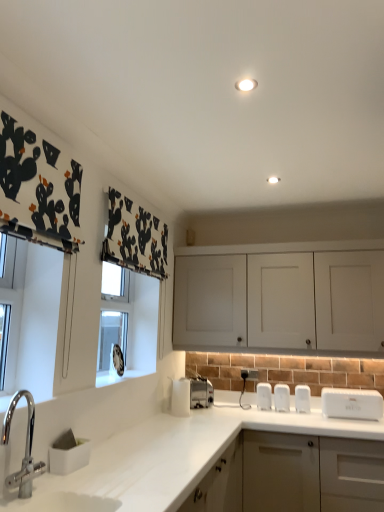
What do you see at coordinates (264, 396) in the screenshot? The image size is (384, 512). I see `white plastic salt and pepper shakers at center, which is the second appliance from left to right` at bounding box center [264, 396].

How much space does white matte cabinet at upper center, which ranks as the 1th cabinetry in top-to-bottom order, occupy horizontally?

The width of white matte cabinet at upper center, which ranks as the 1th cabinetry in top-to-bottom order, is 16.98 inches.

Looking at this image, what is the approximate width of brushed metal faucet at lower left?

The width of brushed metal faucet at lower left is 4.35 inches.

Where is `white plastic salt and pepper shakers at center, which is the second appliance from left to right`? white plastic salt and pepper shakers at center, which is the second appliance from left to right is located at coordinates (264, 396).

Does point (253, 374) appear closer or farther from the camera than point (261, 406)?

Point (253, 374) is positioned farther from the camera compared to point (261, 406).

From the image's perspective, which is below, white plastic electric outlet at lower center or white plastic salt and pepper shakers at center, which is the second appliance from left to right?

white plastic salt and pepper shakers at center, which is the second appliance from left to right, appears lower in the image.

Does white plastic electric outlet at lower center have a smaller size compared to white plastic salt and pepper shakers at center, placed as the 2th appliance when sorted from right to left?

Correct, white plastic electric outlet at lower center occupies less space than white plastic salt and pepper shakers at center, placed as the 2th appliance when sorted from right to left.

Is white plastic electric outlet at lower center directly adjacent to white plastic salt and pepper shakers at center, placed as the 2th appliance when sorted from right to left?

white plastic electric outlet at lower center and white plastic salt and pepper shakers at center, placed as the 2th appliance when sorted from right to left, are clearly separated.

Which of these two, white matte countertop at lower left or satin silver toaster at lower center, arranged as the 3th appliance when viewed from the right, is bigger?

white matte countertop at lower left.

Is white matte countertop at lower left taller than satin silver toaster at lower center, placed as the first appliance when sorted from left to right?

Yes, white matte countertop at lower left is taller than satin silver toaster at lower center, placed as the first appliance when sorted from left to right.

Consider the image. From a real-world perspective, does white matte countertop at lower left sit lower than satin silver toaster at lower center, arranged as the 3th appliance when viewed from the right?

Yes, from a real-world perspective, white matte countertop at lower left is under satin silver toaster at lower center, arranged as the 3th appliance when viewed from the right.

From the picture: Can you confirm if brushed metal faucet at lower left is positioned to the right of satin silver toaster at lower center, placed as the first appliance when sorted from left to right?

In fact, brushed metal faucet at lower left is to the left of satin silver toaster at lower center, placed as the first appliance when sorted from left to right.

Which object is thinner, brushed metal faucet at lower left or satin silver toaster at lower center, arranged as the 3th appliance when viewed from the right?

With smaller width is brushed metal faucet at lower left.

Locate an element on the screen. Image resolution: width=384 pixels, height=512 pixels. tap below the satin silver toaster at lower center, arranged as the 3th appliance when viewed from the right (from a real-world perspective) is located at coordinates (25, 448).

Based on the photo, considering the relative sizes of brushed metal faucet at lower left and satin silver toaster at lower center, arranged as the 3th appliance when viewed from the right, in the image provided, is brushed metal faucet at lower left bigger than satin silver toaster at lower center, arranged as the 3th appliance when viewed from the right,?

Actually, brushed metal faucet at lower left might be smaller than satin silver toaster at lower center, arranged as the 3th appliance when viewed from the right.

Between satin silver toaster at lower center, arranged as the 3th appliance when viewed from the right, and brushed metal faucet at lower left, which one appears on the left side from the viewer's perspective?

From the viewer's perspective, brushed metal faucet at lower left appears more on the left side.

Which appliance is the 2nd one when counting from the back of the brushed metal faucet at lower left? Please provide its 2D coordinates.

[(191, 395)]

Is satin silver toaster at lower center, placed as the first appliance when sorted from left to right, far away from brushed metal faucet at lower left?

Answer: satin silver toaster at lower center, placed as the first appliance when sorted from left to right, is far away from brushed metal faucet at lower left.

Which object is closer to the camera taking this photo, satin silver toaster at lower center, placed as the first appliance when sorted from left to right, or brushed metal faucet at lower left?

brushed metal faucet at lower left is more forward.

Considering the positions of objects satin silver toaster at lower center, placed as the first appliance when sorted from left to right, and white matte countertop at lower left in the image provided, who is more to the left, satin silver toaster at lower center, placed as the first appliance when sorted from left to right, or white matte countertop at lower left?

Positioned to the left is white matte countertop at lower left.

Looking at this image, is satin silver toaster at lower center, arranged as the 3th appliance when viewed from the right, thinner than white matte countertop at lower left?

Yes.

Considering the relative sizes of satin silver toaster at lower center, arranged as the 3th appliance when viewed from the right, and white matte countertop at lower left in the image provided, is satin silver toaster at lower center, arranged as the 3th appliance when viewed from the right, taller than white matte countertop at lower left?

No, satin silver toaster at lower center, arranged as the 3th appliance when viewed from the right, is not taller than white matte countertop at lower left.

Is satin silver toaster at lower center, placed as the first appliance when sorted from left to right, inside or outside of white matte countertop at lower left?

satin silver toaster at lower center, placed as the first appliance when sorted from left to right, lies outside white matte countertop at lower left.

Can you tell me how much white matte countertop at lower left and white plastic toaster at right, which is counted as the first appliance, starting from the right, differ in facing direction?

The angle between the facing direction of white matte countertop at lower left and the facing direction of white plastic toaster at right, which is counted as the first appliance, starting from the right, is 89.4 degrees.

Is white matte countertop at lower left inside or outside of white plastic toaster at right, which is the 3th appliance from left to right?

white matte countertop at lower left exists outside the volume of white plastic toaster at right, which is the 3th appliance from left to right.

Does white matte countertop at lower left appear on the left side of white plastic toaster at right, which is counted as the first appliance, starting from the right?

Yes, white matte countertop at lower left is to the left of white plastic toaster at right, which is counted as the first appliance, starting from the right.

Is white matte countertop at lower left positioned far away from white plastic toaster at right, which is counted as the first appliance, starting from the right?

No, white matte countertop at lower left is not far from white plastic toaster at right, which is counted as the first appliance, starting from the right.

Is white plastic toaster at right, which is counted as the first appliance, starting from the right, shorter than white plastic electric outlet at lower center?

Incorrect, the height of white plastic toaster at right, which is counted as the first appliance, starting from the right, does not fall short of that of white plastic electric outlet at lower center.

Does white plastic toaster at right, which is the 3th appliance from left to right, have a greater width compared to white plastic electric outlet at lower center?

Yes, white plastic toaster at right, which is the 3th appliance from left to right, is wider than white plastic electric outlet at lower center.

From the image's perspective, between white plastic toaster at right, which is counted as the first appliance, starting from the right, and white plastic electric outlet at lower center, which one is located above?

white plastic electric outlet at lower center appears higher in the image.

Which object is positioned more to the right, white plastic toaster at right, which is the 3th appliance from left to right, or white plastic electric outlet at lower center?

Positioned to the right is white plastic toaster at right, which is the 3th appliance from left to right.

From the white plastic electric outlet at lower center, count 1st appliances forward and point to it. Please provide its 2D coordinates.

[(264, 396)]

In the image, there is a satin silver toaster at lower center, placed as the first appliance when sorted from left to right. Where is `countertop below it (from a real-world perspective)`? countertop below it (from a real-world perspective) is located at coordinates click(171, 455).

Considering their positions, is matte white cabinet at lower right, placed as the first cabinetry when sorted from bottom to top, positioned closer to white plastic salt and pepper shakers at center, placed as the 2th appliance when sorted from right to left, than white plastic electric outlet at lower center?

white plastic electric outlet at lower center lies closer to white plastic salt and pepper shakers at center, placed as the 2th appliance when sorted from right to left, than the other object.

Which object lies further to the anchor point white plastic electric outlet at lower center, white matte cabinet at upper center, the 2th cabinetry from the bottom, or white plastic salt and pepper shakers at center, placed as the 2th appliance when sorted from right to left?

white matte cabinet at upper center, the 2th cabinetry from the bottom.

Considering their positions, is matte white cabinet at lower right, placed as the first cabinetry when sorted from bottom to top, positioned closer to white matte cabinet at upper center, which ranks as the 1th cabinetry in top-to-bottom order, than white matte countertop at lower left?

white matte countertop at lower left is positioned closer to the anchor white matte cabinet at upper center, which ranks as the 1th cabinetry in top-to-bottom order.

Estimate the real-world distances between objects in this image. Which object is closer to white plastic salt and pepper shakers at center, placed as the 2th appliance when sorted from right to left, matte white cabinet at lower right, placed as the first cabinetry when sorted from bottom to top, or white plastic toaster at right, which is counted as the first appliance, starting from the right?

Based on the image, white plastic toaster at right, which is counted as the first appliance, starting from the right, appears to be nearer to white plastic salt and pepper shakers at center, placed as the 2th appliance when sorted from right to left.

Based on the photo, considering their positions, is white plastic electric outlet at lower center positioned closer to white matte countertop at lower left than matte white cabinet at lower right, arranged as the 2th cabinetry when viewed from the top?

matte white cabinet at lower right, arranged as the 2th cabinetry when viewed from the top, is closer to white matte countertop at lower left.

From the image, which object appears to be farther from white plastic toaster at right, which is the 3th appliance from left to right, brushed metal faucet at lower left or white plastic electric outlet at lower center?

brushed metal faucet at lower left lies further to white plastic toaster at right, which is the 3th appliance from left to right, than the other object.

From the image, which object appears to be farther from white matte countertop at lower left, white plastic salt and pepper shakers at center, placed as the 2th appliance when sorted from right to left, or white plastic electric outlet at lower center?

white plastic electric outlet at lower center.

Considering their positions, is white matte cabinet at upper center, the 2th cabinetry from the bottom, positioned further to matte white cabinet at lower right, arranged as the 2th cabinetry when viewed from the top, than white matte countertop at lower left?

Based on the image, white matte cabinet at upper center, the 2th cabinetry from the bottom, appears to be further to matte white cabinet at lower right, arranged as the 2th cabinetry when viewed from the top.

Where is `cabinetry between white matte countertop at lower left and white matte cabinet at upper center, the 2th cabinetry from the bottom, in the front-back direction`? cabinetry between white matte countertop at lower left and white matte cabinet at upper center, the 2th cabinetry from the bottom, in the front-back direction is located at coordinates (292, 475).

Locate an element on the screen. This screenshot has width=384, height=512. countertop situated between brushed metal faucet at lower left and matte white cabinet at lower right, placed as the first cabinetry when sorted from bottom to top, from left to right is located at coordinates (171, 455).

This screenshot has width=384, height=512. In order to click on appliance located between white matte countertop at lower left and satin silver toaster at lower center, placed as the first appliance when sorted from left to right, in the depth direction in this screenshot , I will do click(352, 403).

The image size is (384, 512). Find the location of `cabinetry located between brushed metal faucet at lower left and matte white cabinet at lower right, arranged as the 2th cabinetry when viewed from the top, in the left-right direction`. cabinetry located between brushed metal faucet at lower left and matte white cabinet at lower right, arranged as the 2th cabinetry when viewed from the top, in the left-right direction is located at coordinates (273, 296).